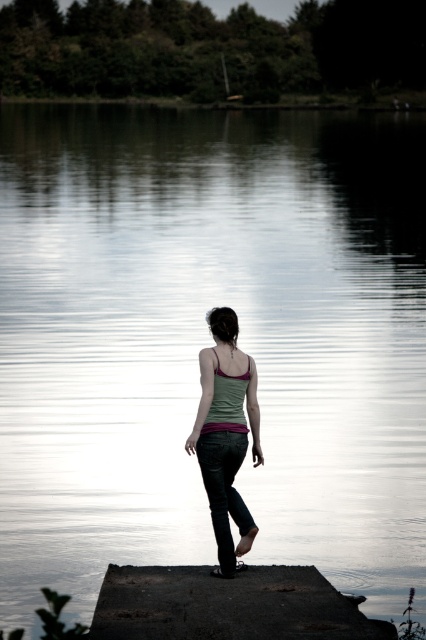
Question: Which of the following is the farthest from the observer?

Choices:
 (A) matte green tank top at center
 (B) dark concrete dock at center

Answer: (A)

Question: Among these points, which one is nearest to the camera?

Choices:
 (A) (230, 461)
 (B) (137, 632)

Answer: (B)

Question: Does dark concrete dock at center appear over matte green tank top at center?

Choices:
 (A) no
 (B) yes

Answer: (A)

Question: From the image, what is the correct spatial relationship of dark concrete dock at center in relation to matte green tank top at center?

Choices:
 (A) right
 (B) left

Answer: (B)

Question: Observing the image, what is the correct spatial positioning of dark concrete dock at center in reference to matte green tank top at center?

Choices:
 (A) above
 (B) below

Answer: (B)